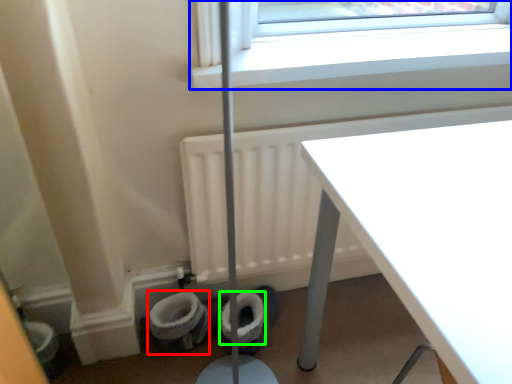
Question: Considering the real-world distances, which object is closest to toilet bowl (highlighted by a red box)? window (highlighted by a blue box) or toilet paper (highlighted by a green box).

Choices:
 (A) window
 (B) toilet paper

Answer: (B)